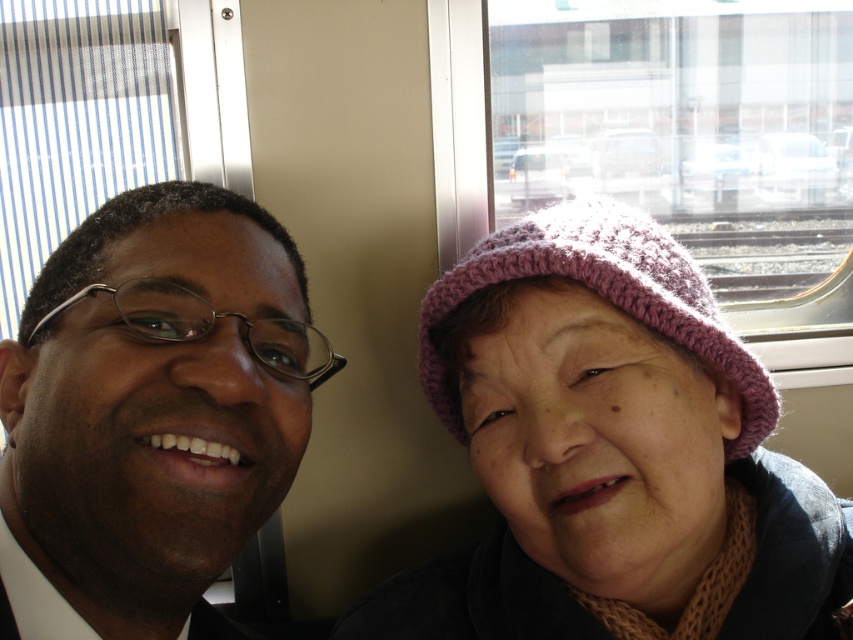
From the picture: Can you confirm if matte black glasses at left is positioned to the left of pink knitted hat at upper right?

Indeed, matte black glasses at left is positioned on the left side of pink knitted hat at upper right.

Does matte black glasses at left have a lesser width compared to pink knitted hat at upper right?

Correct, matte black glasses at left's width is less than pink knitted hat at upper right's.

Who is more distant from viewer, (230, 241) or (747, 410)?

Positioned behind is point (747, 410).

The width and height of the screenshot is (853, 640). I want to click on matte black glasses at left, so click(x=151, y=413).

Can you confirm if knitted pink hat at right is wider than matte black glasses at left?

Yes, knitted pink hat at right is wider than matte black glasses at left.

Between point (515, 413) and point (230, 397), which one is positioned behind?

The point (515, 413) is more distant.

What are the coordinates of `knitted pink hat at right` in the screenshot? It's located at (610, 451).

I want to click on knitted pink hat at right, so click(x=610, y=451).

Is the position of knitted pink hat at right more distant than that of pink knitted hat at upper right?

No, it is not.

What do you see at coordinates (610, 451) in the screenshot?
I see `knitted pink hat at right` at bounding box center [610, 451].

Find the location of a particular element. The image size is (853, 640). knitted pink hat at right is located at coordinates (610, 451).